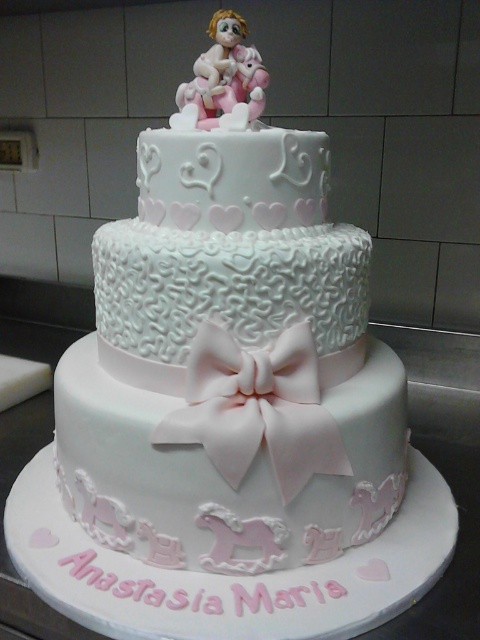
Question: Where is pink satin bow at center located in relation to pink porcelain figurine at top in the image?

Choices:
 (A) right
 (B) left

Answer: (A)

Question: Can you confirm if pink satin bow at center is smaller than pink porcelain figurine at top?

Choices:
 (A) no
 (B) yes

Answer: (A)

Question: Which of the following is the closest to the observer?

Choices:
 (A) pink satin bow at center
 (B) pink porcelain figurine at top

Answer: (A)

Question: Is pink satin bow at center wider than pink porcelain figurine at top?

Choices:
 (A) no
 (B) yes

Answer: (B)

Question: Among these points, which one is nearest to the camera?

Choices:
 (A) click(223, 35)
 (B) click(195, 394)

Answer: (B)

Question: Which object appears closest to the camera in this image?

Choices:
 (A) pink porcelain figurine at top
 (B) pink satin bow at center

Answer: (B)